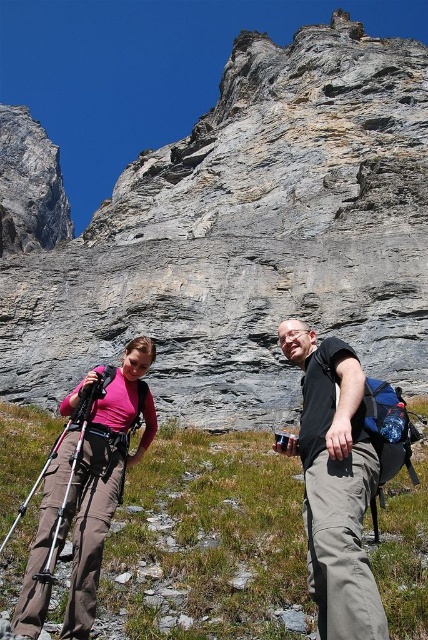
Question: Which object is farther from the camera taking this photo?

Choices:
 (A) gray rock formation at center
 (B) matte pink shirt at lower left

Answer: (A)

Question: Is green grassy at center further to the viewer compared to matte pink shirt at lower left?

Choices:
 (A) no
 (B) yes

Answer: (B)

Question: Which point is farther from the camera taking this photo?

Choices:
 (A) (329, 64)
 (B) (359, 582)

Answer: (A)

Question: Does black cotton shirt at center appear on the right side of matte pink shirt at lower left?

Choices:
 (A) no
 (B) yes

Answer: (B)

Question: Does green grassy at center appear under matte pink shirt at lower left?

Choices:
 (A) yes
 (B) no

Answer: (A)

Question: Which object is closer to the camera taking this photo?

Choices:
 (A) gray rock formation at center
 (B) matte pink shirt at lower left
 (C) green grassy at center

Answer: (B)